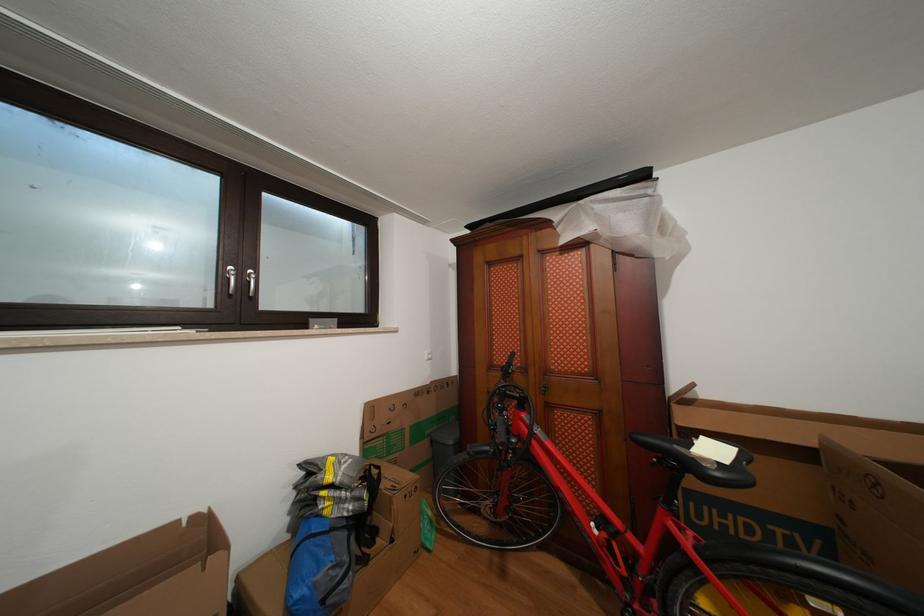
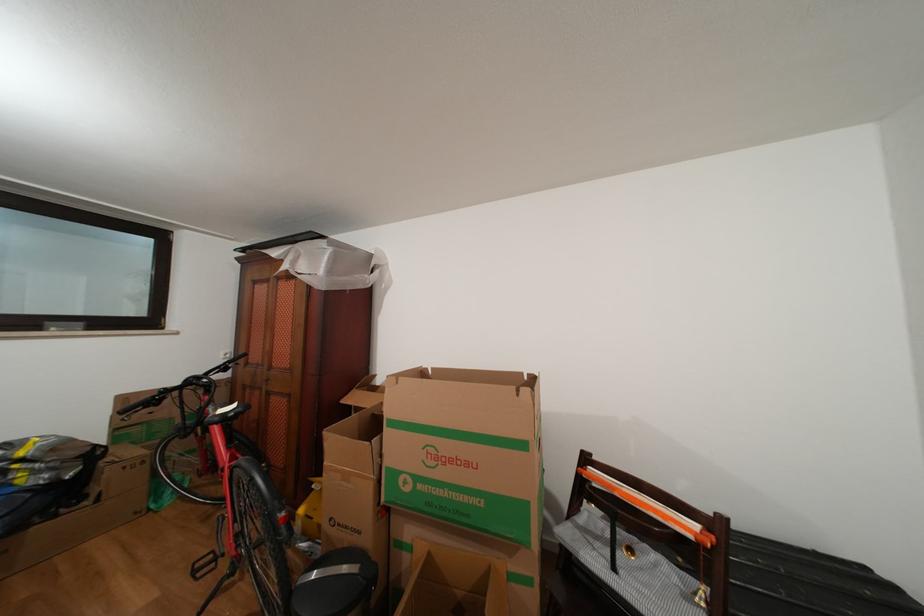
The point at (545, 437) is marked in the first image. Where is the corresponding point in the second image?

(219, 414)